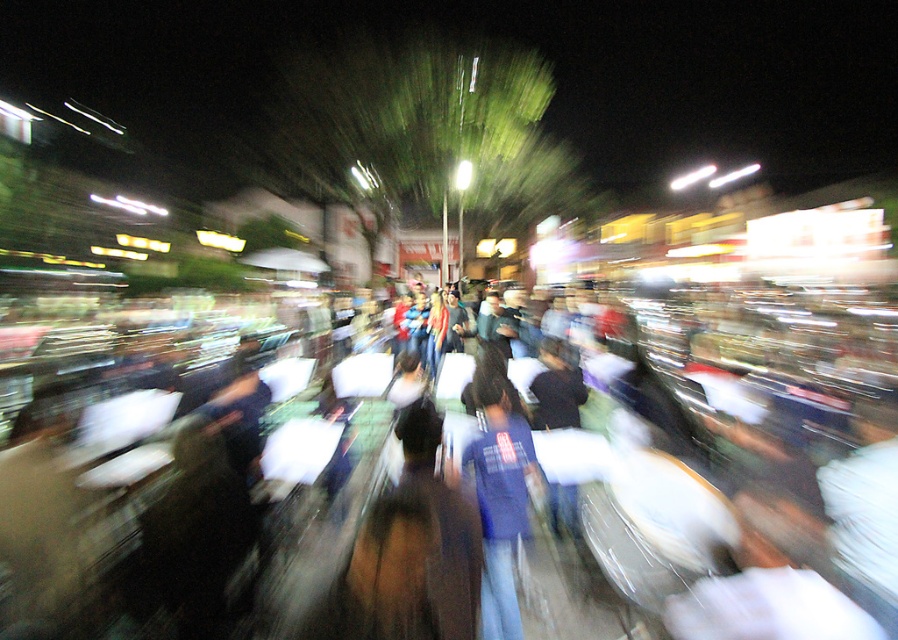
You are a delivery person who needs to deliver a package to a customer standing at the center of the scene. The customer is wearing a blue cotton shirt at center and is surrounded by white cotton pillows at center. Can you safely hand over the package without hitting any of the pillows?

The white cotton pillows at center and blue cotton shirt at center are 26.82 inches apart. Since the distance between them is sufficient, you can safely hand over the package without hitting any of the pillows.

You are a photographer trying to capture a clear image of the blue cotton shirt at center and the white cotton pillows at center in this busy night scene. Which object will appear more blurred in the final photo?

The blue cotton shirt at center will appear more blurred because it is behind the white cotton pillows at center, meaning it is farther away from the camera and thus more likely to be out of focus or blurred due to the motion and depth in the scene.